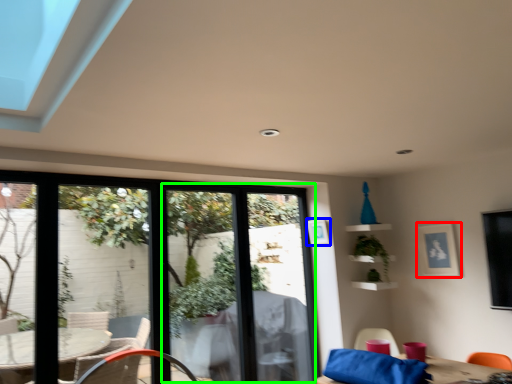
Question: Based on their relative distances, which object is farther from picture frame (highlighted by a red box)? Choose from picture frame (highlighted by a blue box) and screen door (highlighted by a green box).

Choices:
 (A) picture frame
 (B) screen door

Answer: (B)